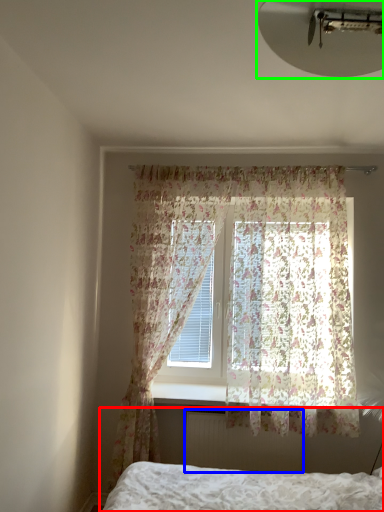
Question: Estimate the real-world distances between objects in this image. Which object is closer to bed (highlighted by a red box), radiator (highlighted by a blue box) or light fixture (highlighted by a green box)?

Choices:
 (A) radiator
 (B) light fixture

Answer: (A)